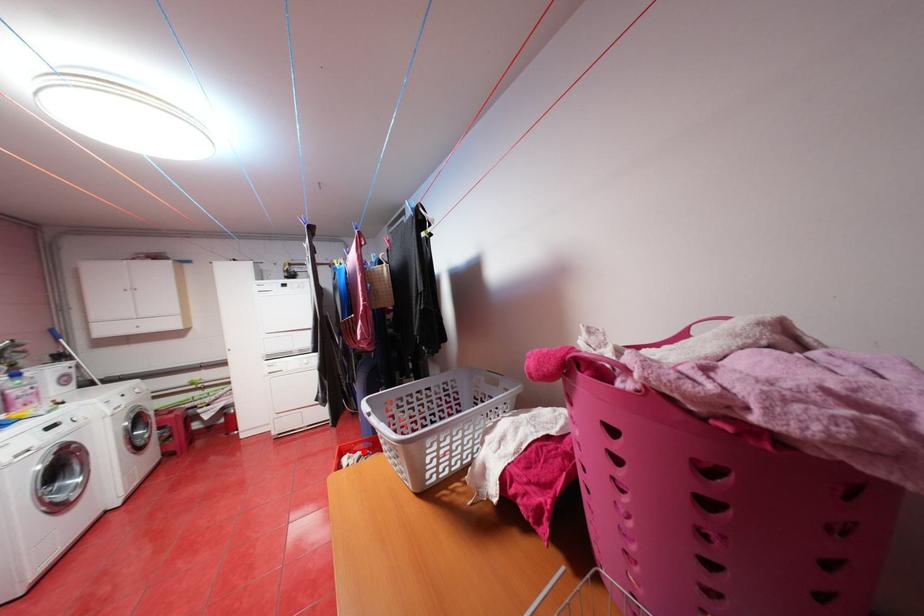
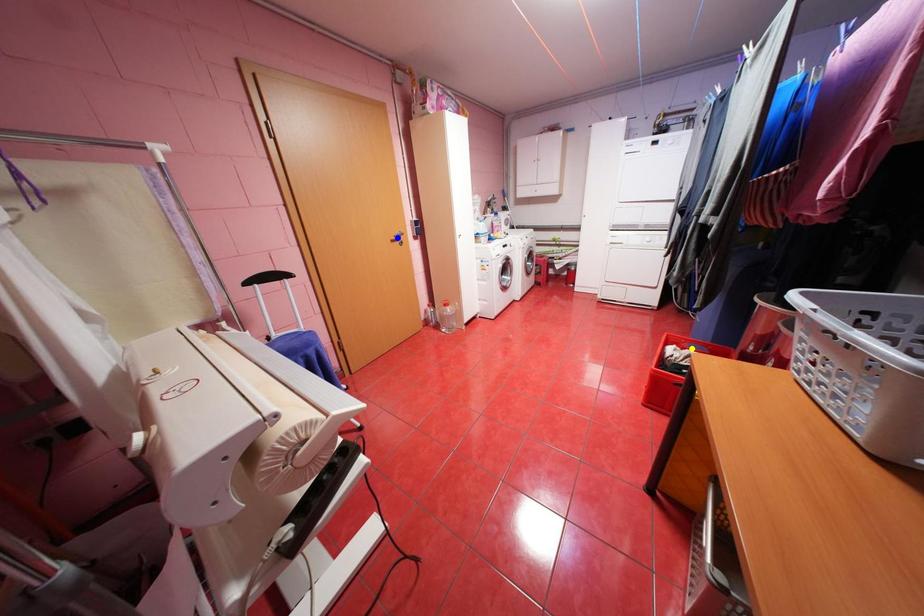
Question: I am providing you with two images of the same scene from different viewpoints. A red point is marked on the first image. You are given multiple points on the second image. Which mark in image 2 goes with the point in image 1?

Choices:
 (A) green point
 (B) blue point
 (C) yellow point

Answer: (C)